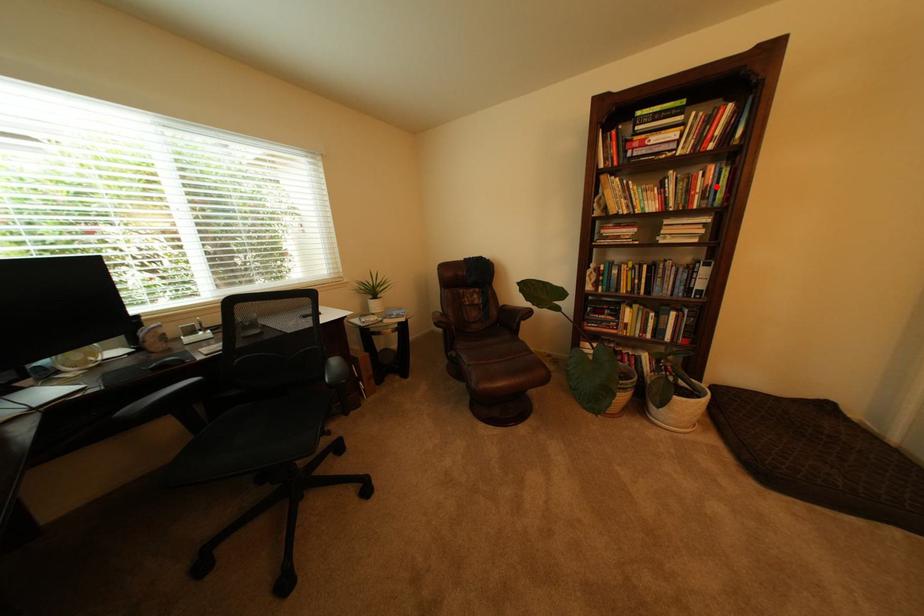
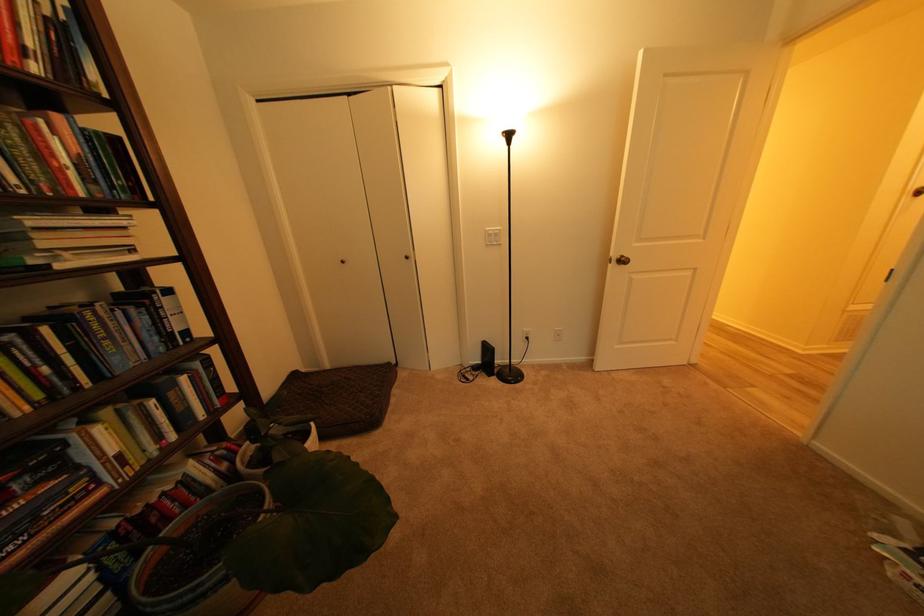
Find the pixel in the second image that matches the highlighted location in the first image.

(84, 156)